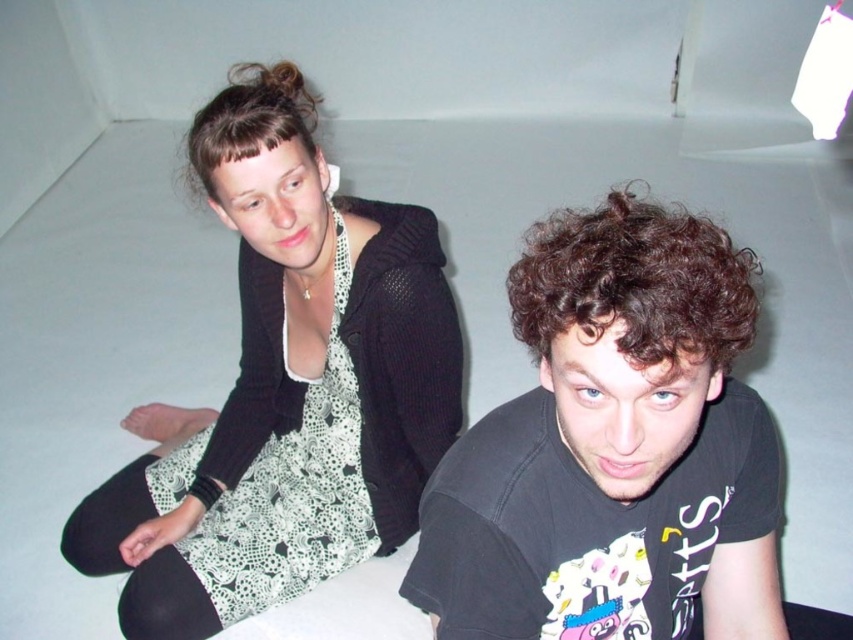
You are standing in the room and see the point at coordinates [613,449]. Which object is this point located on?

The point at coordinates [613,449] is located on the black matte t shirt at center.